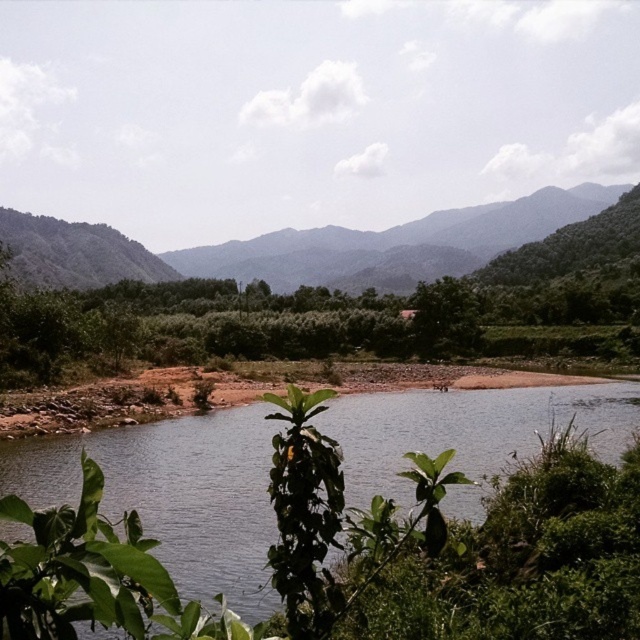
Question: Based on their relative distances, which object is farther from the clear water at center?

Choices:
 (A) green leafy mountain at left
 (B) green leafy tree at center

Answer: (A)

Question: Among these points, which one is farthest from the camera?

Choices:
 (A) (321, 282)
 (B) (458, 342)
 (C) (224, 540)

Answer: (A)

Question: Can you confirm if clear water at center is positioned above green leafy mountain at left?

Choices:
 (A) no
 (B) yes

Answer: (A)

Question: Is clear water at center behind green leafy mountain at left?

Choices:
 (A) yes
 (B) no

Answer: (B)

Question: Is clear water at center to the left of green leafy mountain at left from the viewer's perspective?

Choices:
 (A) yes
 (B) no

Answer: (A)

Question: Which of the following is the farthest from the observer?

Choices:
 (A) (x=3, y=240)
 (B) (x=440, y=328)
 (C) (x=634, y=384)

Answer: (A)